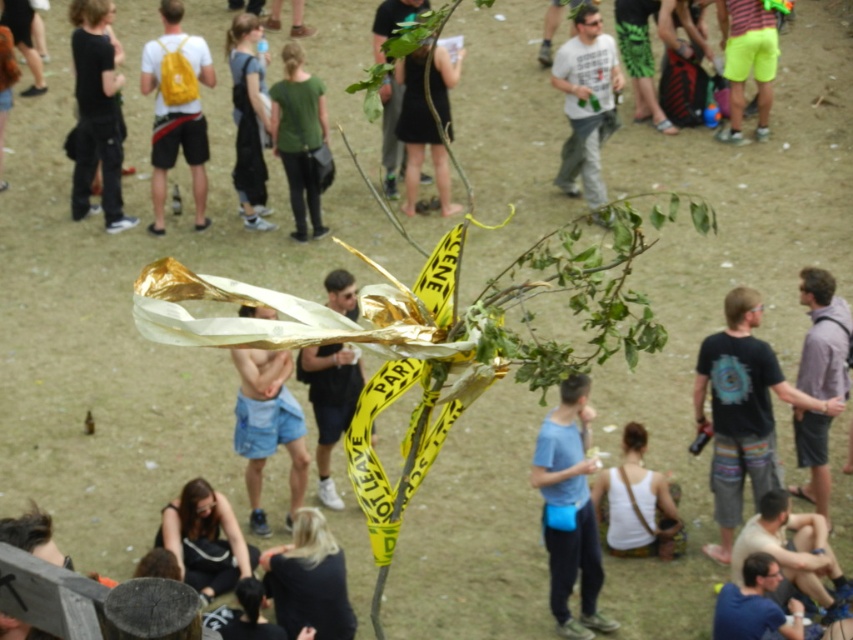
You are organizing a festival and need to ensure that attendees can move freely between the matte black backpack at left and the denim shorts at center. What is the minimum width of the path required to allow comfortable passage for a person carrying a large backpack?

The minimum width of the path required to allow comfortable passage for a person carrying a large backpack is 5.50 meters, as the distance between the matte black backpack at left and the denim shorts at center is 5.50 meters.

You are a photographer at the event and want to capture a photo that includes both the blonde hair at lower center and the dark gray overalls at center. Based on their heights, which object should be placed closer to the camera to ensure both are fully visible in the frame?

The blonde hair at lower center is shorter than the dark gray overalls at center. To ensure both are fully visible, position the blonde hair at lower center closer to the camera since it is shorter, allowing the taller dark gray overalls at center to be captured in the background without obstruction.